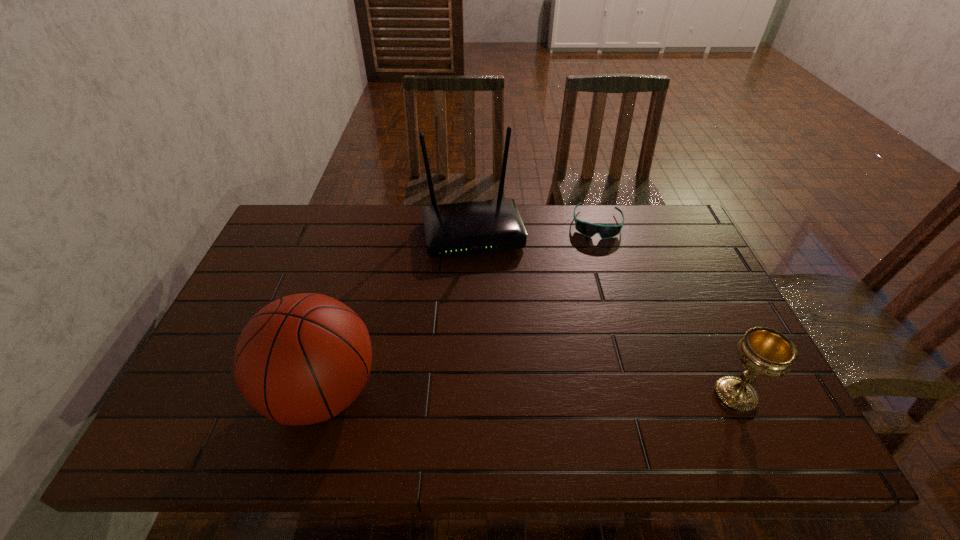
In the image, there is a desktop. In order to click on vacant region at the far edge in this screenshot , I will do `click(404, 205)`.

You are a GUI agent. You are given a task and a screenshot of the screen. Output one action in this format:
    pyautogui.click(x=<x>, y=<y>)
    Task: Click on the vacant area at the near edge of the desktop
    
    Given the screenshot: What is the action you would take?
    pyautogui.click(x=458, y=377)

Where is `vacant space at the left edge`? vacant space at the left edge is located at coordinates (219, 336).

Where is `free space at the right edge of the desktop`? The height and width of the screenshot is (540, 960). free space at the right edge of the desktop is located at coordinates (725, 319).

Image resolution: width=960 pixels, height=540 pixels. I want to click on vacant space at the far left corner of the desktop, so click(x=303, y=226).

Locate an element on the screen. Image resolution: width=960 pixels, height=540 pixels. vacant area at the far right corner of the desktop is located at coordinates [x=664, y=242].

Identify the location of blank region between the third tallest object and the router. (604, 314).

This screenshot has height=540, width=960. I want to click on free space between the second object from left to right and the chalice, so click(x=604, y=314).

Where is `free space between the basketball and the rightmost object`? The image size is (960, 540). free space between the basketball and the rightmost object is located at coordinates (529, 394).

This screenshot has width=960, height=540. Identify the location of free space between the basketball and the chalice. (529, 394).